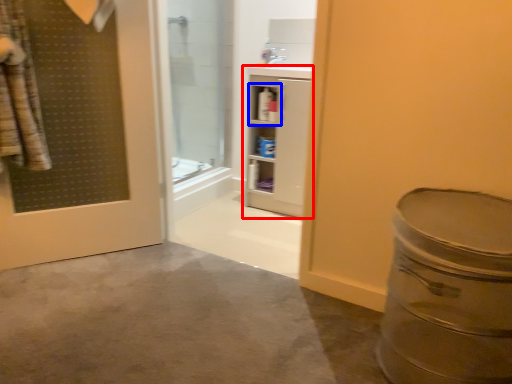
Question: Which of the following is the closest to the observer, bathroom cabinet (highlighted by a red box) or cabinet (highlighted by a blue box)?

Choices:
 (A) bathroom cabinet
 (B) cabinet

Answer: (A)